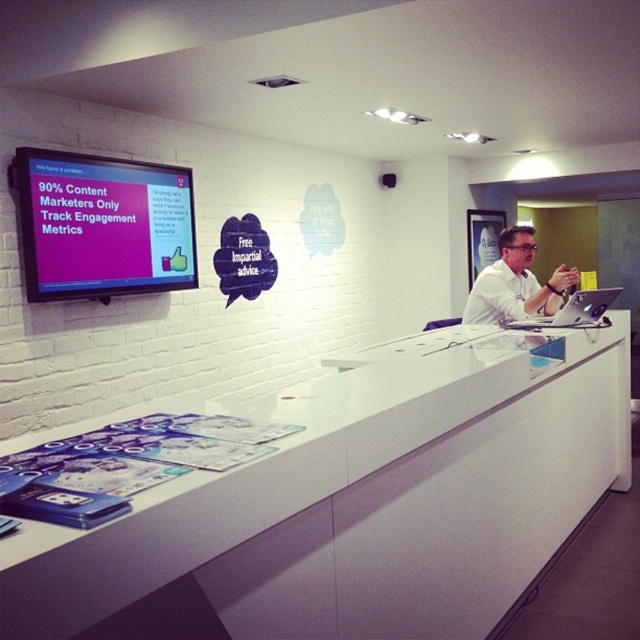
You are a customer standing in front of the reception area. You need to place a small object on the white glossy counter at center and the white shirt at center. Which surface is taller and can accommodate the object without it falling off?

The white glossy counter at center is taller than the white shirt at center, so placing the object on the white glossy counter at center ensures it stays elevated and won

You are a customer standing at the entrance of the office reception area. You need to place a large box that is 1.2 meters wide on the white glossy counter at center or the white shirt at center. Which surface can accommodate the box based on their widths?

The white glossy counter at center is wider than the white shirt at center, so the large box that is 1.2 meters wide can be placed on the white glossy counter at center.